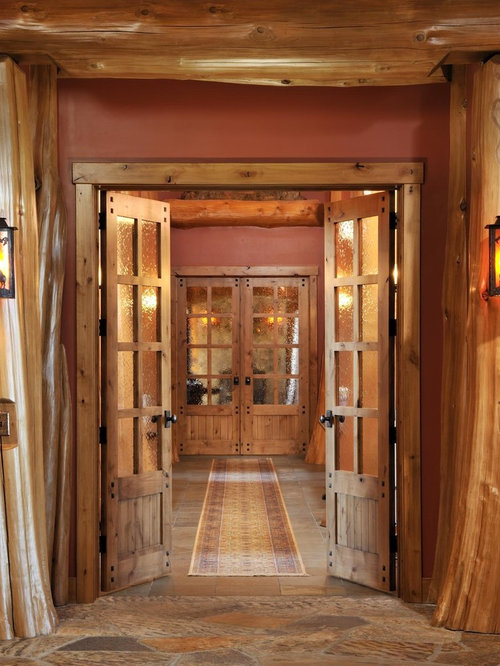
Find the location of `carpet runner`. carpet runner is located at coordinates (247, 523).